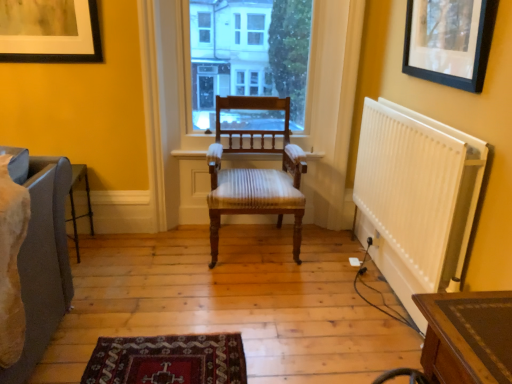
Question: Does black matte picture frame at upper right, the 1th picture frame from the right, have a larger size compared to matte black picture frame at upper left, arranged as the 1th picture frame when viewed from the back?

Choices:
 (A) no
 (B) yes

Answer: (A)

Question: Can we say black matte picture frame at upper right, which is the 1th picture frame from front to back, lies outside matte black picture frame at upper left, the second picture frame from the front?

Choices:
 (A) no
 (B) yes

Answer: (B)

Question: From the image's perspective, is black matte picture frame at upper right, which is the 1th picture frame from front to back, located beneath matte black picture frame at upper left, marked as the first picture frame in a left-to-right arrangement?

Choices:
 (A) yes
 (B) no

Answer: (A)

Question: From the image's perspective, is black matte picture frame at upper right, the 1th picture frame from the right, located above matte black picture frame at upper left, the second picture frame from the right?

Choices:
 (A) no
 (B) yes

Answer: (A)

Question: Could you tell me if black matte picture frame at upper right, placed as the 2th picture frame when sorted from left to right, is turned towards matte black picture frame at upper left, the second picture frame from the right?

Choices:
 (A) yes
 (B) no

Answer: (A)

Question: From the image's perspective, relative to wooden chair at center, is black matte picture frame at upper right, which is the 1th picture frame from front to back, above or below?

Choices:
 (A) above
 (B) below

Answer: (A)

Question: Is black matte picture frame at upper right, which is the 1th picture frame from front to back, wider or thinner than wooden chair at center?

Choices:
 (A) wide
 (B) thin

Answer: (B)

Question: Would you say black matte picture frame at upper right, which is the 1th picture frame from front to back, is to the left or to the right of wooden chair at center in the picture?

Choices:
 (A) right
 (B) left

Answer: (A)

Question: In terms of height, does black matte picture frame at upper right, placed as the 2th picture frame when sorted from left to right, look taller or shorter compared to wooden chair at center?

Choices:
 (A) short
 (B) tall

Answer: (A)

Question: Is matte black picture frame at upper left, marked as the first picture frame in a left-to-right arrangement, in front of or behind black matte picture frame at upper right, which is the 1th picture frame from front to back, in the image?

Choices:
 (A) behind
 (B) front

Answer: (A)

Question: Based on their sizes in the image, would you say matte black picture frame at upper left, the second picture frame from the right, is bigger or smaller than black matte picture frame at upper right, placed as the 2th picture frame when sorted from left to right?

Choices:
 (A) small
 (B) big

Answer: (B)

Question: From the image's perspective, is matte black picture frame at upper left, the second picture frame from the right, positioned above or below black matte picture frame at upper right, placed as the 2th picture frame when sorted from left to right?

Choices:
 (A) above
 (B) below

Answer: (A)

Question: From their relative heights in the image, would you say matte black picture frame at upper left, marked as the first picture frame in a left-to-right arrangement, is taller or shorter than black matte picture frame at upper right, which is the 1th picture frame from front to back?

Choices:
 (A) tall
 (B) short

Answer: (B)

Question: Considering the positions of white plastic radiator at right and wooden chair at center in the image, is white plastic radiator at right wider or thinner than wooden chair at center?

Choices:
 (A) wide
 (B) thin

Answer: (B)

Question: From their relative heights in the image, would you say white plastic radiator at right is taller or shorter than wooden chair at center?

Choices:
 (A) short
 (B) tall

Answer: (B)